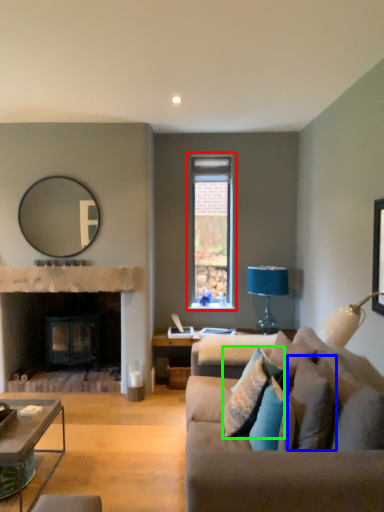
Question: Which is farther away from window (highlighted by a red box)? pillow (highlighted by a blue box) or pillow (highlighted by a green box)?

Choices:
 (A) pillow
 (B) pillow

Answer: (A)